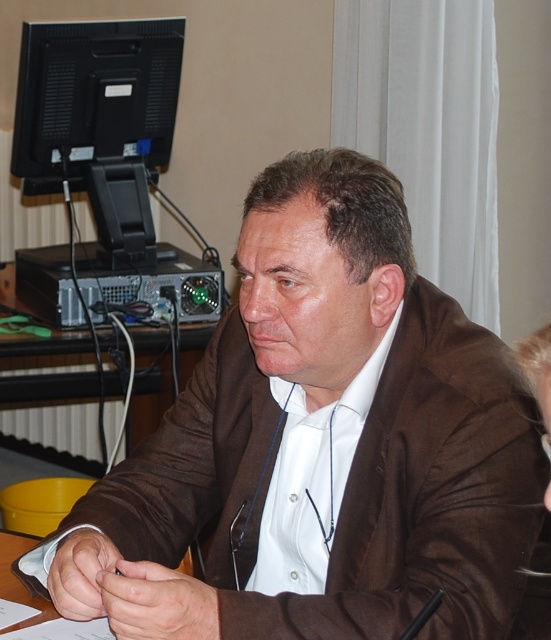
Which of these two, brown fabric jacket at center or black matte monitor at upper left, stands taller?

With more height is brown fabric jacket at center.

Does brown fabric jacket at center appear on the right side of black matte monitor at upper left?

Yes, brown fabric jacket at center is to the right of black matte monitor at upper left.

Which is behind, point (225, 531) or point (161, 115)?

Point (161, 115)

This screenshot has width=551, height=640. In order to click on brown fabric jacket at center in this screenshot , I will do `click(320, 445)`.